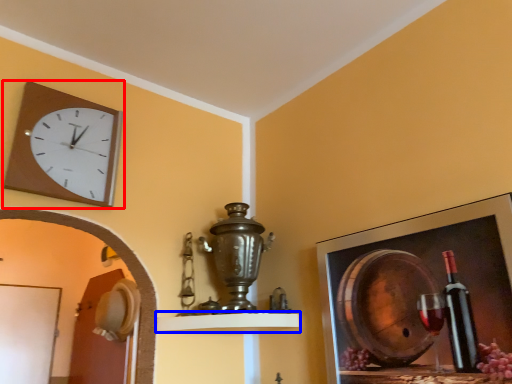
Question: Which object appears closest to the camera in this image, wall clock (highlighted by a red box) or shelf (highlighted by a blue box)?

Choices:
 (A) wall clock
 (B) shelf

Answer: (A)